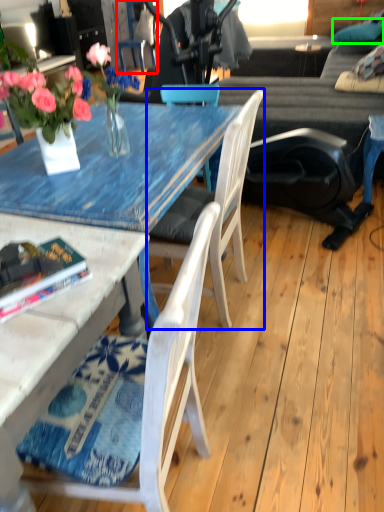
Question: Which object is positioned farthest from chair (highlighted by a red box)? Select from chair (highlighted by a blue box) and pillow (highlighted by a green box).

Choices:
 (A) chair
 (B) pillow

Answer: (B)